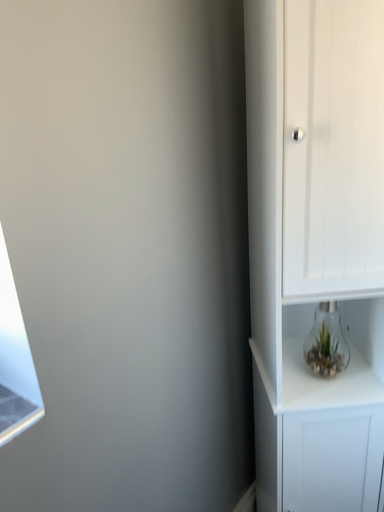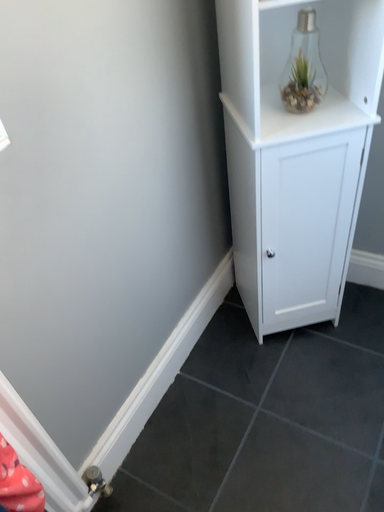
Question: How did the camera likely rotate when shooting the video?

Choices:
 (A) rotated upward
 (B) rotated downward

Answer: (B)